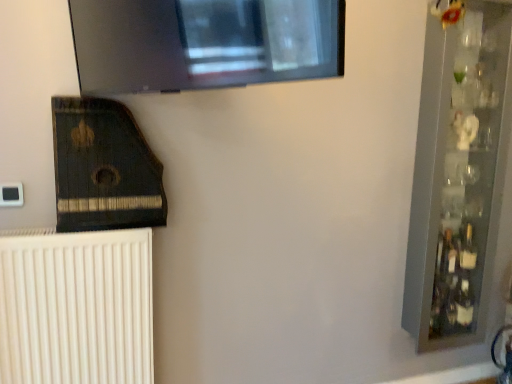
This screenshot has height=384, width=512. Describe the element at coordinates (448, 259) in the screenshot. I see `clear glass bottle at right` at that location.

Locate an element on the screen. Image resolution: width=512 pixels, height=384 pixels. white ribbed radiator at lower left is located at coordinates (77, 308).

What do you see at coordinates (458, 169) in the screenshot?
I see `clear glass shelf at right` at bounding box center [458, 169].

Find the location of a particular element. The image size is (512, 384). clear glass bottle at right is located at coordinates (448, 259).

Is clear glass shelf at right completely or partially outside of dark wood harp at lower left?

Yes, clear glass shelf at right is located beyond the bounds of dark wood harp at lower left.

Considering the sizes of objects clear glass shelf at right and dark wood harp at lower left in the image provided, who is bigger, clear glass shelf at right or dark wood harp at lower left?

clear glass shelf at right.

How distant is clear glass shelf at right from dark wood harp at lower left?

They are 4.69 feet apart.

Is clear glass shelf at right aimed at dark wood harp at lower left?

No, clear glass shelf at right is not aimed at dark wood harp at lower left.

Choose the correct answer: Is clear glass shelf at right inside white ribbed radiator at lower left or outside it?

The correct answer is: outside.

From the picture: From the image's perspective, relative to white ribbed radiator at lower left, is clear glass shelf at right above or below?

Based on their image positions, clear glass shelf at right is located above white ribbed radiator at lower left.

Is clear glass shelf at right far away from white ribbed radiator at lower left?

That's right, there is a large distance between clear glass shelf at right and white ribbed radiator at lower left.

Between clear glass shelf at right and white ribbed radiator at lower left, which one has less height?

white ribbed radiator at lower left.

Is white ribbed radiator at lower left touching clear glass shelf at right?

A: They are not placed beside each other.

Can clear glass shelf at right be found inside white ribbed radiator at lower left?

Actually, clear glass shelf at right is outside white ribbed radiator at lower left.

Does white ribbed radiator at lower left have a lesser width compared to clear glass shelf at right?

Yes, white ribbed radiator at lower left is thinner than clear glass shelf at right.

Which object is more forward, white ribbed radiator at lower left or clear glass shelf at right?

white ribbed radiator at lower left is more forward.

Is white ribbed radiator at lower left located outside clear glass bottle at right?

white ribbed radiator at lower left is positioned outside clear glass bottle at right.

Is white ribbed radiator at lower left far away from clear glass bottle at right?

Yes, white ribbed radiator at lower left is far from clear glass bottle at right.

From the image's perspective, which one is positioned lower, white ribbed radiator at lower left or clear glass bottle at right?

white ribbed radiator at lower left, from the image's perspective.

How many degrees apart are the facing directions of white ribbed radiator at lower left and clear glass bottle at right?

1.64 degrees.

Is dark wood harp at lower left to the left of white ribbed radiator at lower left from the viewer's perspective?

No.

Is dark wood harp at lower left positioned with its back to white ribbed radiator at lower left?

That's not correct — dark wood harp at lower left is not looking away from white ribbed radiator at lower left.

Is dark wood harp at lower left not within white ribbed radiator at lower left?

Yes.

From a real-world perspective, does dark wood harp at lower left sit lower than white ribbed radiator at lower left?

Incorrect, from a real-world perspective, dark wood harp at lower left is higher than white ribbed radiator at lower left.

You are a GUI agent. You are given a task and a screenshot of the screen. Output one action in this format:
    pyautogui.click(x=<x>, y=<y>)
    Task: Click on the bottle below the dark wood harp at lower left (from the image's perspective)
    The height and width of the screenshot is (384, 512).
    Given the screenshot: What is the action you would take?
    pyautogui.click(x=448, y=259)

Which is behind, point (56, 155) or point (453, 250)?

The point (453, 250) is farther.

From the picture: How different are the orientations of dark wood harp at lower left and clear glass bottle at right in degrees?

The facing directions of dark wood harp at lower left and clear glass bottle at right are 1.64 degrees apart.

Between dark wood harp at lower left and clear glass bottle at right, which one is positioned in front?

dark wood harp at lower left is closer to the camera.

Where is `radiator that appears on the left of clear glass bottle at right`? The image size is (512, 384). radiator that appears on the left of clear glass bottle at right is located at coordinates (77, 308).

Considering the sizes of clear glass bottle at right and white ribbed radiator at lower left in the image, is clear glass bottle at right taller or shorter than white ribbed radiator at lower left?

clear glass bottle at right is shorter than white ribbed radiator at lower left.

From the image's perspective, is clear glass bottle at right above or below white ribbed radiator at lower left?

Based on their image positions, clear glass bottle at right is located above white ribbed radiator at lower left.

Which object is more forward, clear glass bottle at right or white ribbed radiator at lower left?

white ribbed radiator at lower left.

You are a GUI agent. You are given a task and a screenshot of the screen. Output one action in this format:
    pyautogui.click(x=<x>, y=<y>)
    Task: Click on the amplifier above the clear glass shelf at right (from a real-world perspective)
    
    Given the screenshot: What is the action you would take?
    pyautogui.click(x=103, y=168)

At what (x,y) coordinates should I click in order to perform the action: click on shelf that is above the white ribbed radiator at lower left (from the image's perspective). Please return your answer as a coordinate pair (x, y). The image size is (512, 384). Looking at the image, I should click on (458, 169).

Estimate the real-world distances between objects in this image. Which object is further from dark wood harp at lower left, clear glass shelf at right or clear glass bottle at right?

clear glass bottle at right is further to dark wood harp at lower left.

Which object lies further to the anchor point dark wood harp at lower left, white ribbed radiator at lower left or clear glass shelf at right?

Based on the image, clear glass shelf at right appears to be further to dark wood harp at lower left.

Considering their positions, is clear glass shelf at right positioned further to dark wood harp at lower left than white ribbed radiator at lower left?

The object further to dark wood harp at lower left is clear glass shelf at right.

Considering their positions, is clear glass shelf at right positioned closer to clear glass bottle at right than dark wood harp at lower left?

clear glass shelf at right lies closer to clear glass bottle at right than the other object.

Estimate the real-world distances between objects in this image. Which object is further from white ribbed radiator at lower left, clear glass shelf at right or dark wood harp at lower left?

clear glass shelf at right is positioned further to the anchor white ribbed radiator at lower left.

From the image, which object appears to be farther from white ribbed radiator at lower left, dark wood harp at lower left or clear glass shelf at right?

Based on the image, clear glass shelf at right appears to be further to white ribbed radiator at lower left.

Considering their positions, is dark wood harp at lower left positioned closer to white ribbed radiator at lower left than clear glass bottle at right?

dark wood harp at lower left is positioned closer to the anchor white ribbed radiator at lower left.

When comparing their distances from white ribbed radiator at lower left, does clear glass bottle at right or dark wood harp at lower left seem further?

clear glass bottle at right is further to white ribbed radiator at lower left.

You are a GUI agent. You are given a task and a screenshot of the screen. Output one action in this format:
    pyautogui.click(x=<x>, y=<y>)
    Task: Click on the amplifier situated between white ribbed radiator at lower left and clear glass shelf at right from left to right
    The height and width of the screenshot is (384, 512).
    Given the screenshot: What is the action you would take?
    pyautogui.click(x=103, y=168)

I want to click on shelf between white ribbed radiator at lower left and clear glass bottle at right, so click(x=458, y=169).

This screenshot has width=512, height=384. I want to click on amplifier located between white ribbed radiator at lower left and clear glass bottle at right in the left-right direction, so click(x=103, y=168).

Image resolution: width=512 pixels, height=384 pixels. Identify the location of shelf between dark wood harp at lower left and clear glass bottle at right. (458, 169).